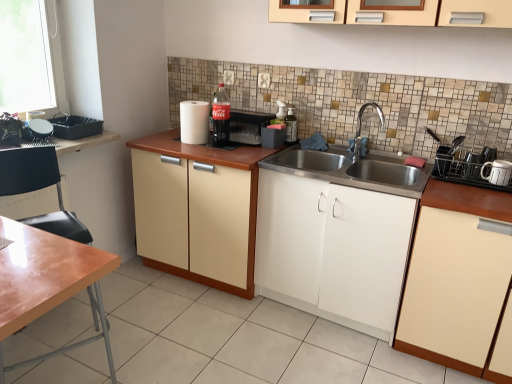
The image size is (512, 384). What are the coordinates of `vacant area that is in front of white paper towel at center, which is the second appliance in left-to-right order` in the screenshot? It's located at (201, 148).